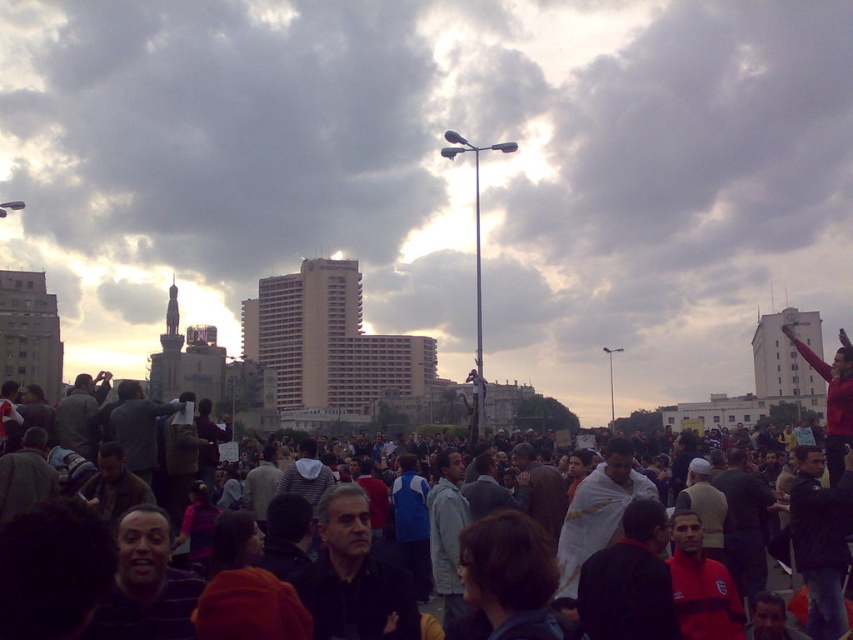
Question: Does cloudy sky at upper center come in front of dark clothing crowd at center?

Choices:
 (A) no
 (B) yes

Answer: (A)

Question: Among these points, which one is nearest to the camera?

Choices:
 (A) (741, 538)
 (B) (247, 125)

Answer: (A)

Question: Is cloudy sky at upper center bigger than dark clothing crowd at center?

Choices:
 (A) yes
 (B) no

Answer: (A)

Question: Which object appears closest to the camera in this image?

Choices:
 (A) dark clothing crowd at center
 (B) cloudy sky at upper center

Answer: (A)

Question: Does cloudy sky at upper center have a greater width compared to dark clothing crowd at center?

Choices:
 (A) yes
 (B) no

Answer: (A)